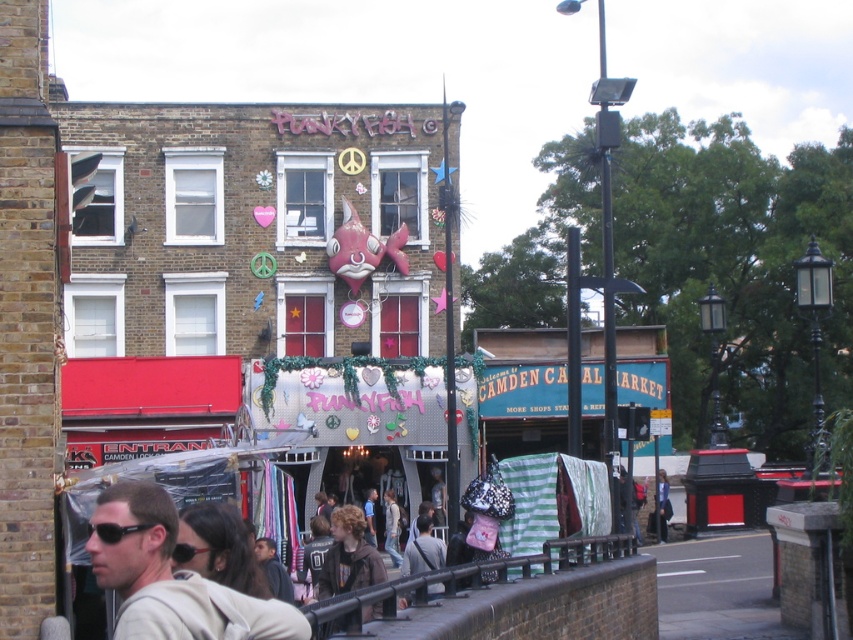
Is black metal railing at lower center positioned behind black plastic goggles at lower left?

No, black metal railing at lower center is closer to the viewer.

Who is more forward, (585, 612) or (183, 541)?

Point (183, 541)

At what (x,y) coordinates should I click in order to perform the action: click on black metal railing at lower center. Please return your answer as a coordinate pair (x, y). Image resolution: width=853 pixels, height=640 pixels. Looking at the image, I should click on (524, 598).

Can you confirm if matte gray hoodie at lower left is smaller than black plastic sunglasses at lower left?

Yes.

What do you see at coordinates (170, 577) in the screenshot? I see `matte gray hoodie at lower left` at bounding box center [170, 577].

Find the location of a particular element. The image size is (853, 640). matte gray hoodie at lower left is located at coordinates (170, 577).

Who is more distant from viewer, (381,637) or (161,541)?

The point (381,637) is behind.

Which is in front, point (537, 586) or point (148, 506)?

Point (148, 506) is more forward.

The height and width of the screenshot is (640, 853). I want to click on black metal railing at lower center, so click(x=524, y=598).